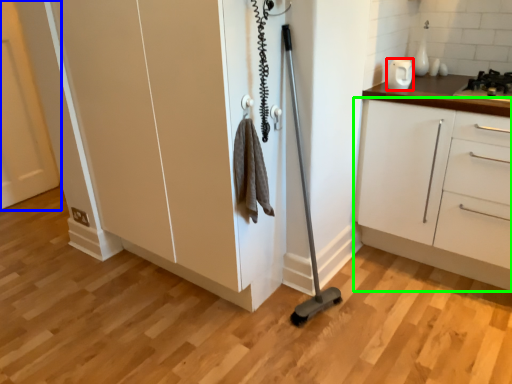
Question: Considering the real-world distances, which object is closest to appliance (highlighted by a red box)? door (highlighted by a blue box) or cabinetry (highlighted by a green box).

Choices:
 (A) door
 (B) cabinetry

Answer: (B)